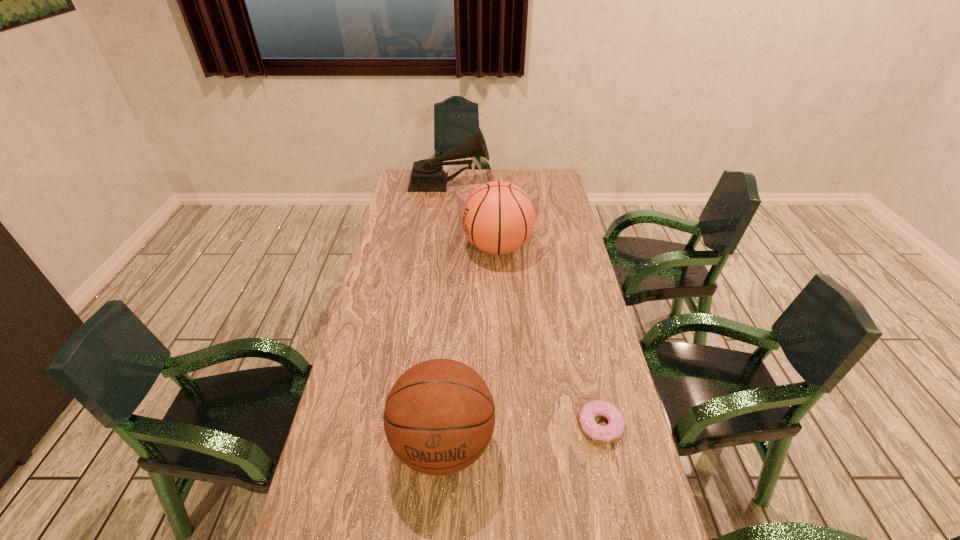
Find the location of `object that is at the far edge`. object that is at the far edge is located at coordinates (427, 175).

The height and width of the screenshot is (540, 960). What are the coordinates of `phonograph_record present at the left edge` in the screenshot? It's located at (427, 175).

The height and width of the screenshot is (540, 960). In order to click on basketball positioned at the left edge in this screenshot , I will do `click(439, 416)`.

Image resolution: width=960 pixels, height=540 pixels. What are the coordinates of `object that is at the right edge` in the screenshot? It's located at (613, 431).

This screenshot has width=960, height=540. In order to click on object present at the far left corner in this screenshot , I will do `click(427, 175)`.

Locate an element on the screen. The width and height of the screenshot is (960, 540). vacant region at the far edge is located at coordinates (451, 185).

The image size is (960, 540). I want to click on vacant space at the left edge of the desktop, so click(372, 289).

I want to click on vacant space at the right edge of the desktop, so click(x=572, y=241).

Locate an element on the screen. Image resolution: width=960 pixels, height=540 pixels. free space at the far right corner of the desktop is located at coordinates (542, 179).

The height and width of the screenshot is (540, 960). Find the location of `vacant area that lies between the nearer basketball and the rightmost object`. vacant area that lies between the nearer basketball and the rightmost object is located at coordinates pyautogui.click(x=521, y=434).